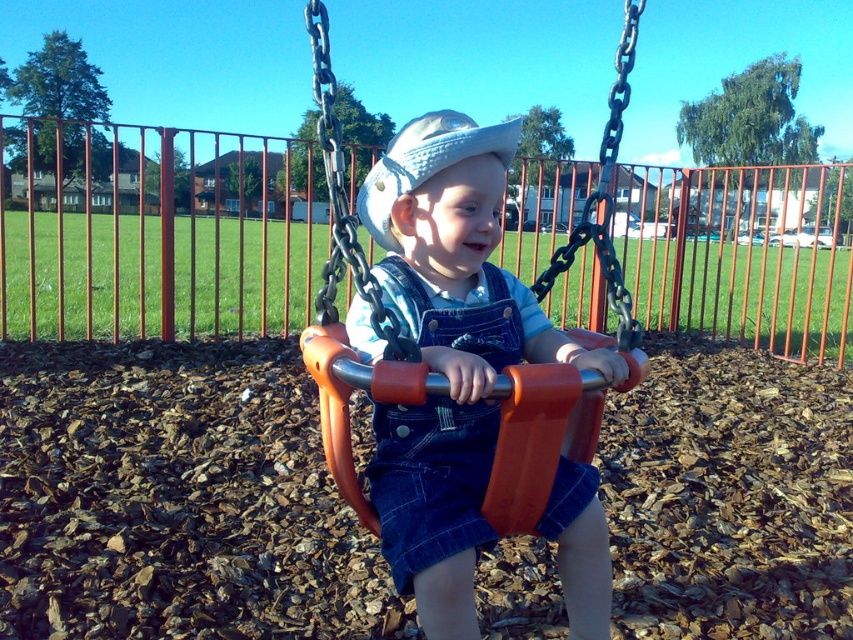
You are a photographer trying to capture the child in the swing. You notice the denim overalls at center and the white fabric hat at center. Which clothing item is located lower on the child?

The denim overalls at center is positioned under the white fabric hat at center, so the denim overalls at center is lower on the child.